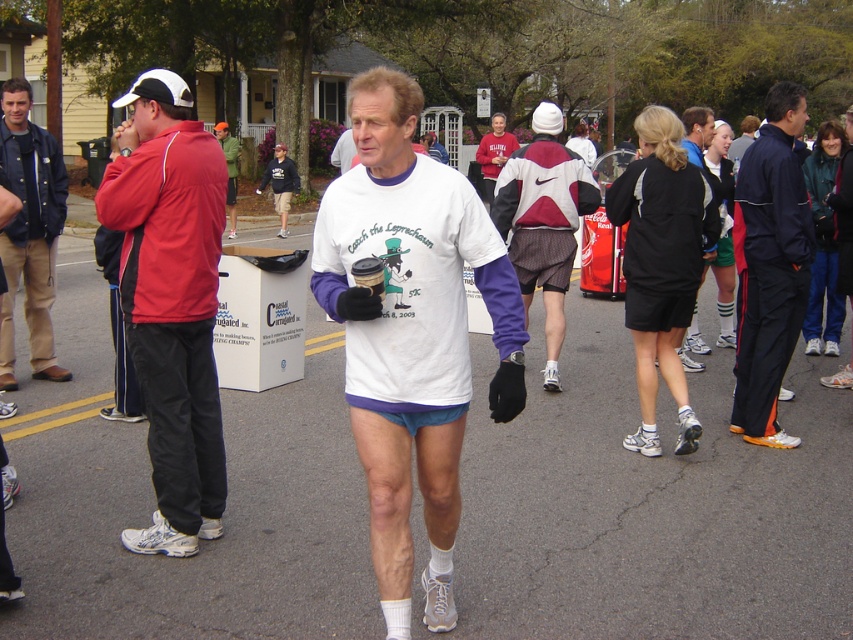
You are standing in the middle of the street at the community event. You see two points marked on the ground ahead of you. The first point is at coordinate point[555,296] and the second point is at coordinate point[9,244]. Which point is closer to you?

Point[555,296] is further to the viewer than point[9,244], so the closer point to you is point[9,244].

You are a photographer at the event and need to capture both the red jacket at left and the black fabric shorts at center in a single shot. Which object should you focus on first to ensure both are in frame?

The red jacket at left is much taller than the black fabric shorts at center. To ensure both are in frame, focus on the red jacket at left first since it occupies more vertical space and adjust the camera angle accordingly.